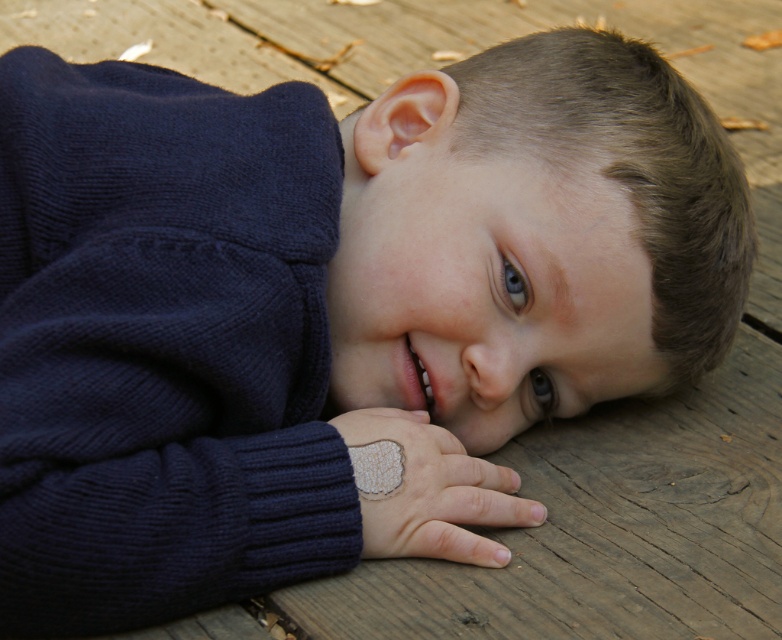
Is point (140, 531) positioned behind point (436, 545)?

No, (140, 531) is closer to viewer.

You are a GUI agent. You are given a task and a screenshot of the screen. Output one action in this format:
    pyautogui.click(x=<x>, y=<y>)
    Task: Click on the navy blue knitted sweater at left
    The width and height of the screenshot is (782, 640).
    Given the screenshot: What is the action you would take?
    [162, 346]